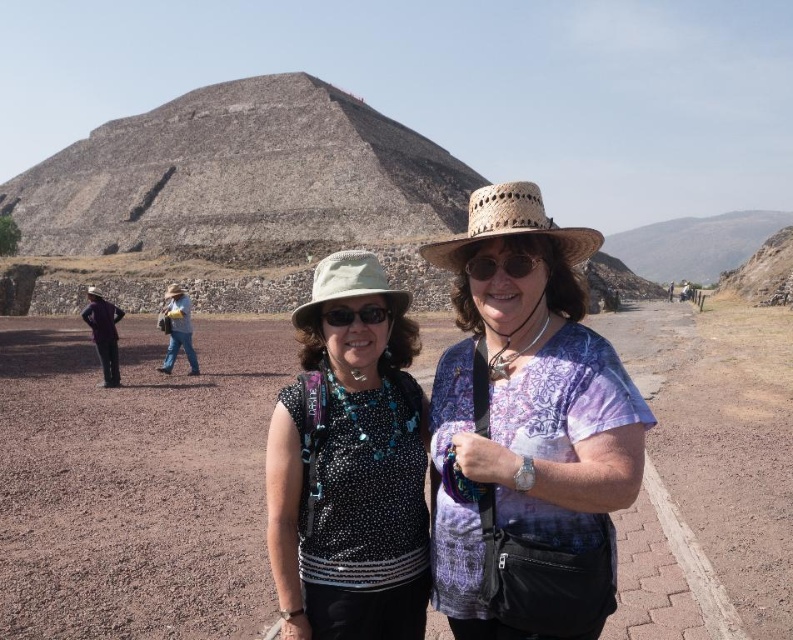
Is point (382, 340) positioned behind point (332, 320)?

Yes, point (382, 340) is behind point (332, 320).

Which of these two, polka dot fabric shirt at center or matte black sunglasses at center, stands taller?

polka dot fabric shirt at center

The image size is (793, 640). What are the coordinates of `polka dot fabric shirt at center` in the screenshot? It's located at (351, 468).

Where is `polka dot fabric shirt at center`? polka dot fabric shirt at center is located at coordinates coord(351,468).

Between denim jeans at center and matte black sunglasses at center, which one is positioned lower?

Positioned lower is matte black sunglasses at center.

Is point (182, 320) positioned after point (328, 308)?

Yes, it is behind point (328, 308).

Which is behind, point (169, 333) or point (378, 308)?

The point (169, 333) is more distant.

At what (x,y) coordinates should I click in order to perform the action: click on denim jeans at center. Please return your answer as a coordinate pair (x, y). Looking at the image, I should click on (177, 330).

Between denim jeans at center and matte brown sunglasses at center, which one has more height?

Standing taller between the two is denim jeans at center.

Does point (175, 316) lie behind point (512, 257)?

That is True.

Does point (165, 356) come farther from viewer compared to point (527, 269)?

Yes, it is behind point (527, 269).

Where is `denim jeans at center`? This screenshot has width=793, height=640. denim jeans at center is located at coordinates (177, 330).